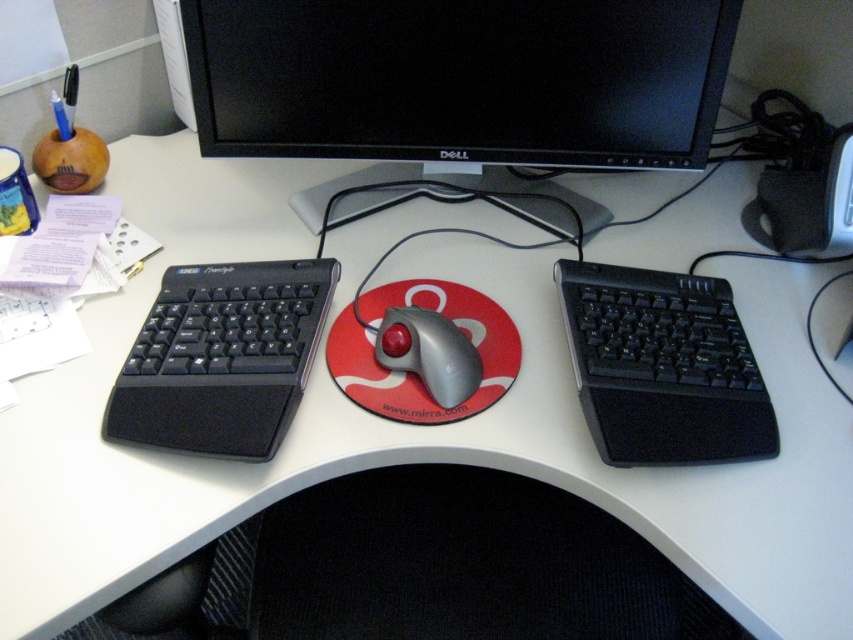
You are organizing the desk and need to place a new wireless charger. The charger requires 10 cm of space in front of it. Can the black matte keyboard at left and the metallic gray trackball at center accommodate this requirement?

The black matte keyboard at left is closer to the viewer than the metallic gray trackball at center, so there is enough space in front of the black matte keyboard at left to place the wireless charger with the required 10 cm.

You are setting up a new mouse pad for your black textured keyboard at right. The mouse pad needs to be placed exactly at the coordinate point where the keyboard is located. What are the coordinates where you should place the mouse pad?

The coordinates for the black textured keyboard at right are at point (662, 365), so you should place the mouse pad at those coordinates.

You are setting up a dual keyboard system on your desk and need to place the black textured keyboard at right and the black matte keyboard at left. Which keyboard should you place closer to the edge of the desk to ensure stability?

The black textured keyboard at right has a greater height, so placing it closer to the edge of the desk would provide better stability due to its sturdier base.